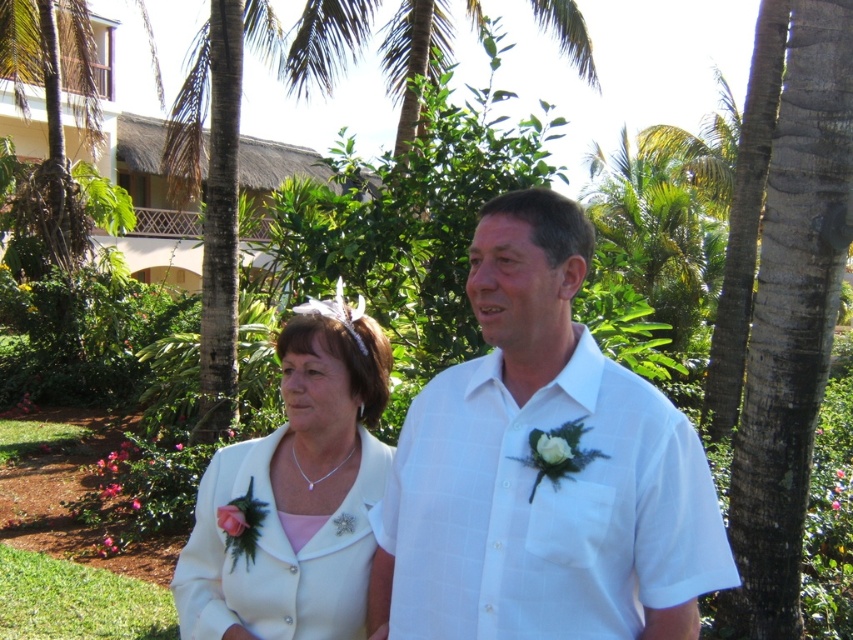
You are a photographer at a wedding and notice the white cotton shirt at center and the white satin jacket at center. Which clothing item is positioned higher on the person?

The white cotton shirt at center is located above the white satin jacket at center, so the white cotton shirt at center is positioned higher.